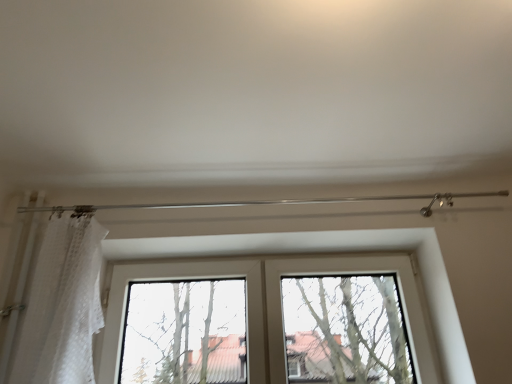
This screenshot has width=512, height=384. Describe the element at coordinates (345, 330) in the screenshot. I see `bare branches at center` at that location.

The height and width of the screenshot is (384, 512). Describe the element at coordinates (185, 333) in the screenshot. I see `clear glass window at center` at that location.

This screenshot has height=384, width=512. Find the location of `bare branches at center`. bare branches at center is located at coordinates (345, 330).

Is white lace curtain at left at the left side of bare branches at center?

Yes.

Would you say white lace curtain at left contains bare branches at center?

No, white lace curtain at left does not contain bare branches at center.

Considering the points (38, 354) and (302, 293), which point is in front, point (38, 354) or point (302, 293)?

The point (38, 354) is in front.

Is white lace curtain at left touching bare branches at center?

No, white lace curtain at left is not touching bare branches at center.

Who is bigger, bare branches at center or clear glass window at center?

clear glass window at center.

Which is less distant, (302, 352) or (161, 293)?

Positioned in front is point (302, 352).

Considering the sizes of bare branches at center and clear glass window at center in the image, is bare branches at center taller or shorter than clear glass window at center?

Clearly, bare branches at center is taller compared to clear glass window at center.

Locate an element on the screen. The width and height of the screenshot is (512, 384). bay window lying on the left of bare branches at center is located at coordinates (185, 333).

From the picture: Does clear glass window at center have a smaller size compared to white lace curtain at left?

No, clear glass window at center is not smaller than white lace curtain at left.

Considering the relative sizes of clear glass window at center and white lace curtain at left in the image provided, is clear glass window at center wider than white lace curtain at left?

In fact, clear glass window at center might be narrower than white lace curtain at left.

Who is shorter, clear glass window at center or white lace curtain at left?

With less height is clear glass window at center.

Is white lace curtain at left taller or shorter than clear glass window at center?

Clearly, white lace curtain at left is taller compared to clear glass window at center.

Looking at the image, does white lace curtain at left seem bigger or smaller compared to clear glass window at center?

Considering their sizes, white lace curtain at left takes up less space than clear glass window at center.

Could you tell me if white lace curtain at left is turned towards clear glass window at center?

No, white lace curtain at left is not oriented towards clear glass window at center.

Is white lace curtain at left positioned far away from clear glass window at center?

No, white lace curtain at left is not far away from clear glass window at center.

Could bare branches at center be considered to be inside clear glass window at center?

No, bare branches at center is located outside of clear glass window at center.

Does point (170, 352) lie behind point (295, 281)?

No, (170, 352) is closer to viewer.

Is clear glass window at center wider than bare branches at center?

Indeed, clear glass window at center has a greater width compared to bare branches at center.

Looking at this image, how much distance is there between clear glass window at center and bare branches at center?

A: They are 17.80 inches apart.

How far apart are bare branches at center and white lace curtain at left?

They are 1.00 meters apart.

Locate an element on the screen. The height and width of the screenshot is (384, 512). shower curtain positioned vertically above the bare branches at center (from a real-world perspective) is located at coordinates (63, 306).

From the image's perspective, which is below, bare branches at center or white lace curtain at left?

bare branches at center is shown below in the image.

Considering the relative sizes of bare branches at center and white lace curtain at left in the image provided, is bare branches at center smaller than white lace curtain at left?

Incorrect, bare branches at center is not smaller in size than white lace curtain at left.

You are a GUI agent. You are given a task and a screenshot of the screen. Output one action in this format:
    pyautogui.click(x=<x>, y=<y>)
    Task: Click on the tree on the right of white lace curtain at left
    The height and width of the screenshot is (384, 512).
    Given the screenshot: What is the action you would take?
    pyautogui.click(x=345, y=330)

You are a GUI agent. You are given a task and a screenshot of the screen. Output one action in this format:
    pyautogui.click(x=<x>, y=<y>)
    Task: Click on the tree above the clear glass window at center (from the image's perspective)
    The height and width of the screenshot is (384, 512).
    Given the screenshot: What is the action you would take?
    click(x=345, y=330)

Which object lies further to the anchor point bare branches at center, white lace curtain at left or clear glass window at center?

white lace curtain at left.

Estimate the real-world distances between objects in this image. Which object is closer to white lace curtain at left, clear glass window at center or bare branches at center?

The object closer to white lace curtain at left is clear glass window at center.

Looking at this image, estimate the real-world distances between objects in this image. Which object is further from clear glass window at center, white lace curtain at left or bare branches at center?

bare branches at center is positioned further to the anchor clear glass window at center.

Estimate the real-world distances between objects in this image. Which object is further from white lace curtain at left, bare branches at center or clear glass window at center?

bare branches at center.

When comparing their distances from bare branches at center, does clear glass window at center or white lace curtain at left seem closer?

clear glass window at center is positioned closer to the anchor bare branches at center.

Estimate the real-world distances between objects in this image. Which object is closer to clear glass window at center, bare branches at center or white lace curtain at left?

white lace curtain at left is closer to clear glass window at center.

You are a GUI agent. You are given a task and a screenshot of the screen. Output one action in this format:
    pyautogui.click(x=<x>, y=<y>)
    Task: Click on the bay window between white lace curtain at left and bare branches at center from left to right
    
    Given the screenshot: What is the action you would take?
    pyautogui.click(x=185, y=333)